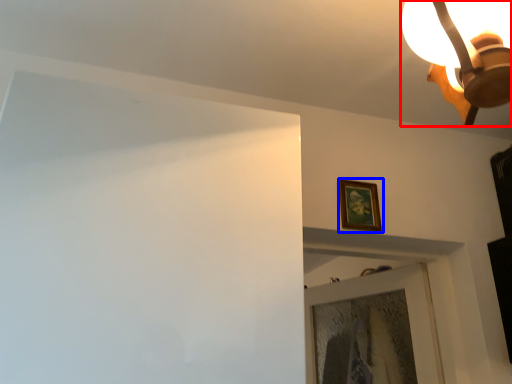
Question: Which object appears farthest to the camera in this image, lamp (highlighted by a red box) or picture frame (highlighted by a blue box)?

Choices:
 (A) lamp
 (B) picture frame

Answer: (B)